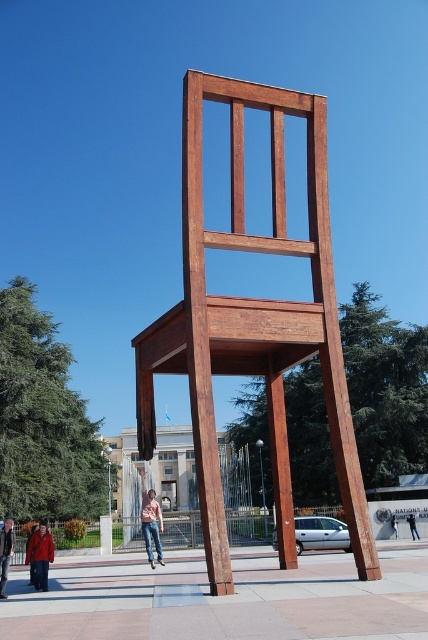
Which is below, red wool coat at lower left or denim jacket at lower left?

denim jacket at lower left is below.

How far apart are red wool coat at lower left and denim jacket at lower left?

red wool coat at lower left is 6.34 feet from denim jacket at lower left.

This screenshot has height=640, width=428. What do you see at coordinates (39, 556) in the screenshot? I see `red wool coat at lower left` at bounding box center [39, 556].

The height and width of the screenshot is (640, 428). I want to click on red wool coat at lower left, so click(x=39, y=556).

Is the position of red wool coat at lower left more distant than that of denim jacket at lower right?

No, red wool coat at lower left is in front of denim jacket at lower right.

Between point (44, 561) and point (391, 518), which one is positioned in front?

Point (44, 561) is more forward.

At what (x,y) coordinates should I click in order to perform the action: click on red wool coat at lower left. Please return your answer as a coordinate pair (x, y). Image resolution: width=428 pixels, height=640 pixels. Looking at the image, I should click on (39, 556).

Is red wool coat at lower left positioned in front of denim jeans at lower center?

Yes, it is.

Can you confirm if red wool coat at lower left is shorter than denim jeans at lower center?

Yes, red wool coat at lower left is shorter than denim jeans at lower center.

Who is more forward, (36,557) or (158,556)?

Point (36,557) is in front.

The image size is (428, 640). In order to click on red wool coat at lower left in this screenshot , I will do `click(39, 556)`.